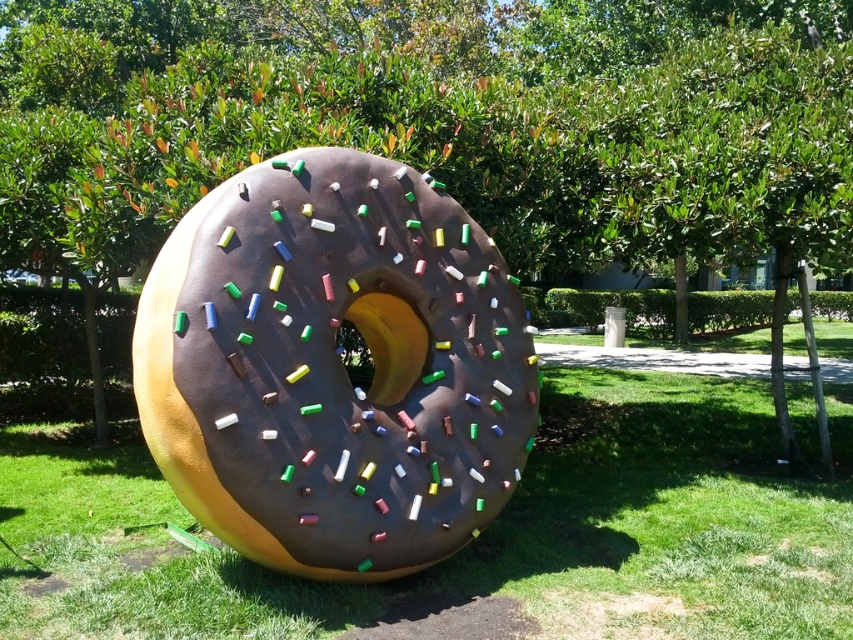
Question: Is green leafy tree at center above chocolate-coated donut at center?

Choices:
 (A) yes
 (B) no

Answer: (A)

Question: Can you confirm if green leafy tree at center is positioned below chocolate-coated donut at center?

Choices:
 (A) yes
 (B) no

Answer: (B)

Question: Which object is the farthest from the green leafy tree at center?

Choices:
 (A) green grass at center
 (B) chocolate-coated donut at center

Answer: (A)

Question: Which point appears farthest from the camera in this image?

Choices:
 (A) (724, 198)
 (B) (244, 486)

Answer: (A)

Question: Does green leafy tree at center appear over green grass at center?

Choices:
 (A) no
 (B) yes

Answer: (B)

Question: Estimate the real-world distances between objects in this image. Which object is farther from the green leafy tree at center?

Choices:
 (A) chocolate-coated donut at center
 (B) green grass at center

Answer: (B)